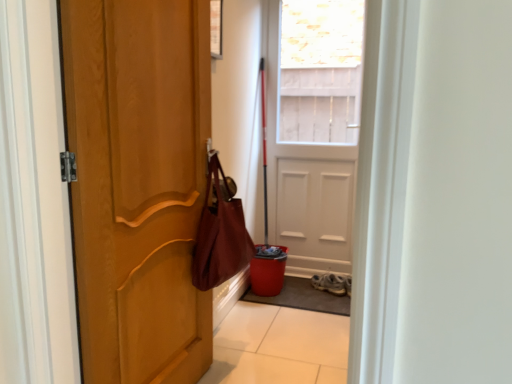
Question: From the image's perspective, does gray textured mat at lower center appear lower than leather-like maroon shoulder bag at center-left?

Choices:
 (A) yes
 (B) no

Answer: (A)

Question: From the image's perspective, would you say gray textured mat at lower center is positioned over leather-like maroon shoulder bag at center-left?

Choices:
 (A) no
 (B) yes

Answer: (A)

Question: Considering the relative sizes of gray textured mat at lower center and leather-like maroon shoulder bag at center-left in the image provided, is gray textured mat at lower center bigger than leather-like maroon shoulder bag at center-left?

Choices:
 (A) no
 (B) yes

Answer: (A)

Question: Is gray textured mat at lower center further to camera compared to leather-like maroon shoulder bag at center-left?

Choices:
 (A) no
 (B) yes

Answer: (B)

Question: Considering the relative positions of gray textured mat at lower center and leather-like maroon shoulder bag at center-left in the image provided, is gray textured mat at lower center to the right of leather-like maroon shoulder bag at center-left from the viewer's perspective?

Choices:
 (A) no
 (B) yes

Answer: (B)

Question: Is point (305, 64) positioned closer to the camera than point (146, 142)?

Choices:
 (A) farther
 (B) closer

Answer: (A)

Question: In the image, is white matte door at center, which is counted as the second door, starting from the left, positioned in front of or behind matte wood door at left, which ranks as the 2th door in back-to-front order?

Choices:
 (A) behind
 (B) front

Answer: (A)

Question: In terms of size, does white matte door at center, which is counted as the 2th door, starting from the front, appear bigger or smaller than matte wood door at left, which ranks as the 2th door in back-to-front order?

Choices:
 (A) big
 (B) small

Answer: (A)

Question: From a real-world perspective, is white matte door at center, which is the first door from back to front, positioned above or below matte wood door at left, marked as the 1th door in a front-to-back arrangement?

Choices:
 (A) above
 (B) below

Answer: (A)

Question: From the image's perspective, is gray textured mat at lower center positioned above or below white matte door at center, which is counted as the second door, starting from the left?

Choices:
 (A) below
 (B) above

Answer: (A)

Question: Relative to white matte door at center, which is counted as the second door, starting from the left, is gray textured mat at lower center in front or behind?

Choices:
 (A) behind
 (B) front

Answer: (B)

Question: In terms of size, does gray textured mat at lower center appear bigger or smaller than white matte door at center, which is counted as the 2th door, starting from the front?

Choices:
 (A) big
 (B) small

Answer: (B)

Question: Would you say gray textured mat at lower center is to the left or to the right of white matte door at center, which is counted as the second door, starting from the left, in the picture?

Choices:
 (A) right
 (B) left

Answer: (B)

Question: Is matte wood door at left, the 1th door in the left-to-right sequence, inside the boundaries of white leather sneakers at lower center, or outside?

Choices:
 (A) inside
 (B) outside

Answer: (B)

Question: Looking at their shapes, would you say matte wood door at left, the 1th door in the left-to-right sequence, is wider or thinner than white leather sneakers at lower center?

Choices:
 (A) thin
 (B) wide

Answer: (A)